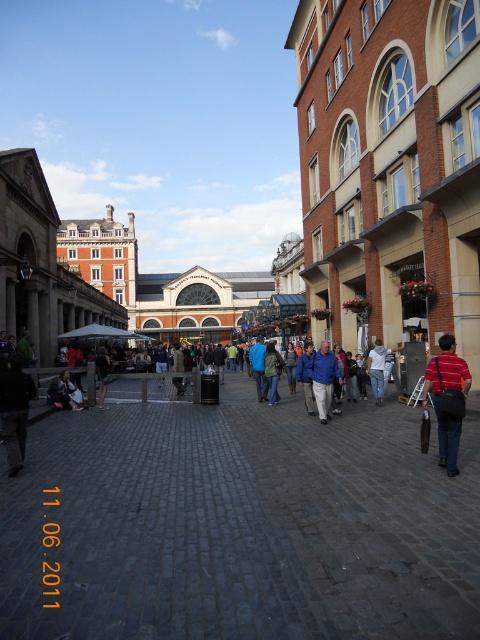
You are a passerby in the urban scene. You notice a striped cotton shirt at lower right and a blue fleece jacket at center. Which clothing item is positioned higher relative to the other?

The striped cotton shirt at lower right is above the blue fleece jacket at center.

You are standing on the cobblestone street in the bustling urban scene. You need to locate the striped cotton shirt at lower right. According to the coordinates provided, where exactly should you look to find it?

The striped cotton shirt at lower right is located at point (447,397).